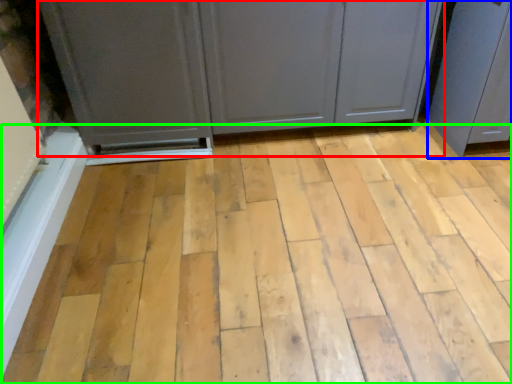
Question: Considering the real-world distances, which object is closest to cupboard (highlighted by a red box)? screen door (highlighted by a blue box) or plank (highlighted by a green box).

Choices:
 (A) screen door
 (B) plank

Answer: (A)